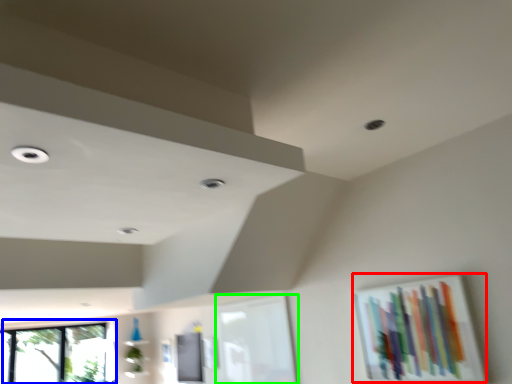
Question: Which object is the farthest from picture frame (highlighted by a red box)? Choose among these: window (highlighted by a blue box) or window frame (highlighted by a green box).

Choices:
 (A) window
 (B) window frame

Answer: (A)